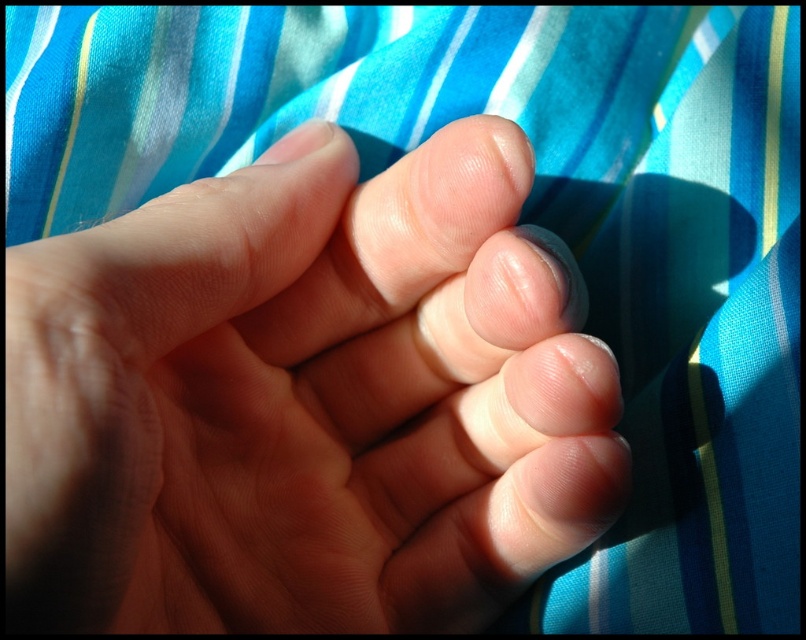
Question: Does smooth skin hand at center have a larger size compared to smooth skin toe at center?

Choices:
 (A) no
 (B) yes

Answer: (B)

Question: Which object is closer to the camera taking this photo?

Choices:
 (A) smooth skin toe at center
 (B) smooth skin hand at center

Answer: (B)

Question: Which of the following is the closest to the observer?

Choices:
 (A) (429, 289)
 (B) (10, 408)

Answer: (B)

Question: Considering the relative positions of smooth skin hand at center and smooth skin toe at center in the image provided, where is smooth skin hand at center located with respect to smooth skin toe at center?

Choices:
 (A) above
 (B) below

Answer: (B)

Question: Where is smooth skin hand at center located in relation to smooth skin toe at center in the image?

Choices:
 (A) below
 (B) above

Answer: (A)